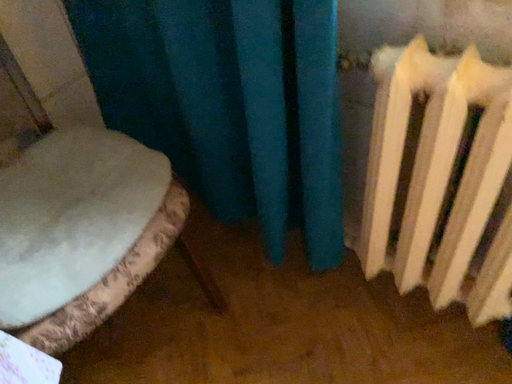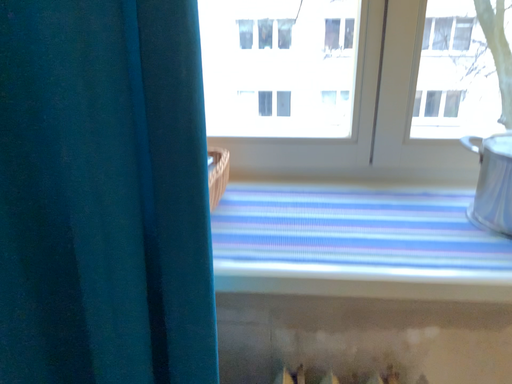
Question: How did the camera likely rotate when shooting the video?

Choices:
 (A) rotated upward
 (B) rotated downward

Answer: (A)